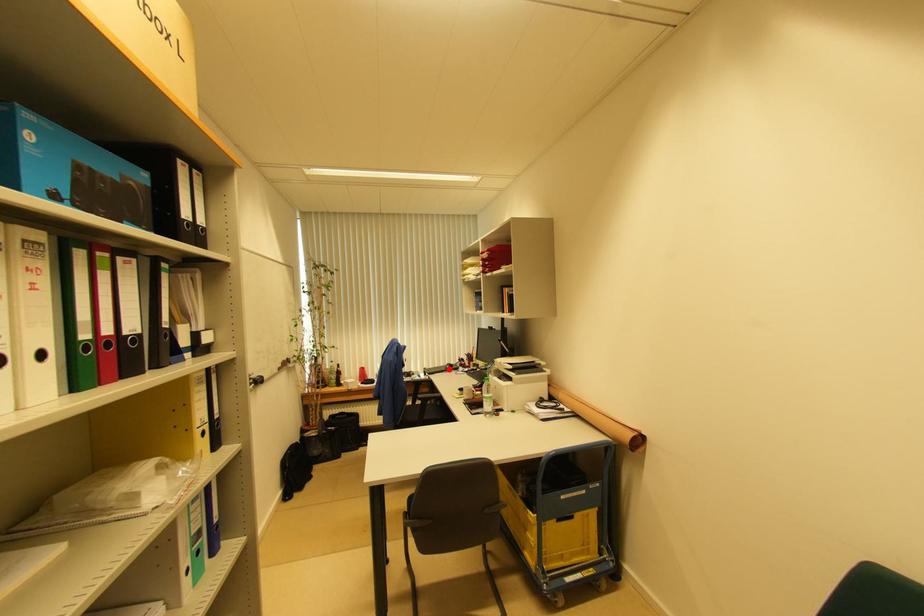
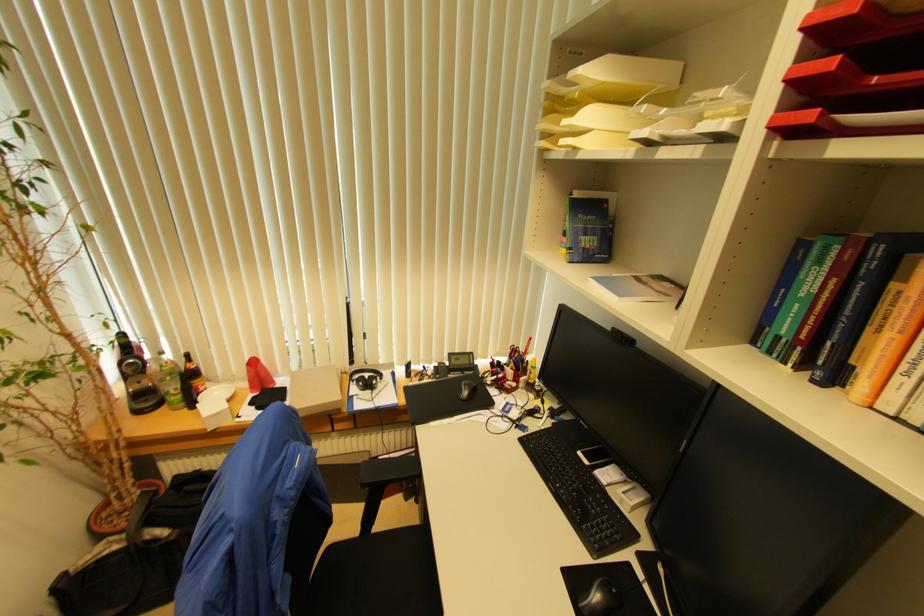
Locate, in the second image, the point that corresponds to the highlighted location in the first image.

(467, 395)